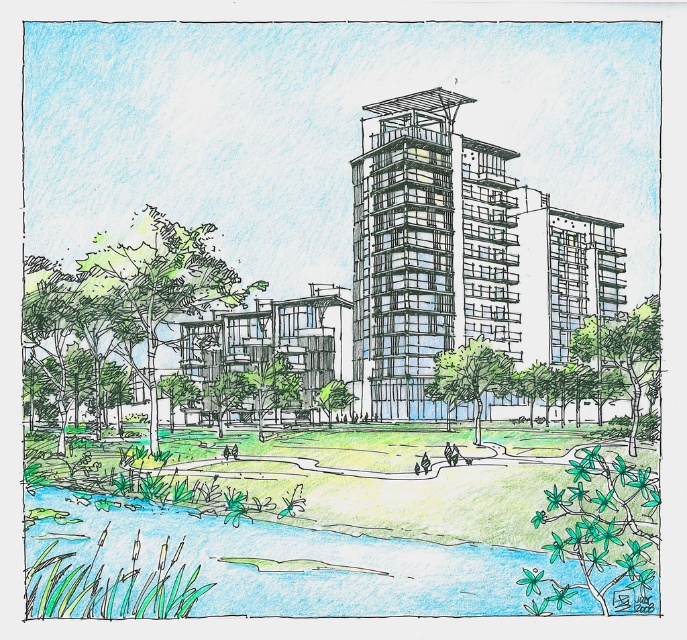
Question: Can you confirm if transparent glass building at center is positioned below blue-green water at lower center?

Choices:
 (A) yes
 (B) no

Answer: (B)

Question: Which object is positioned closest to the blue-green water at lower center?

Choices:
 (A) transparent glass tower at center
 (B) transparent glass building at center

Answer: (A)

Question: Does blue-green water at lower center have a smaller size compared to transparent glass tower at center?

Choices:
 (A) yes
 (B) no

Answer: (A)

Question: Which of the following is the closest to the observer?

Choices:
 (A) (438, 138)
 (B) (530, 307)
 (C) (322, 531)

Answer: (C)

Question: Does transparent glass building at center have a larger size compared to transparent glass tower at center?

Choices:
 (A) no
 (B) yes

Answer: (B)

Question: Which object is farther from the camera taking this photo?

Choices:
 (A) transparent glass building at center
 (B) blue-green water at lower center
 (C) transparent glass tower at center

Answer: (C)